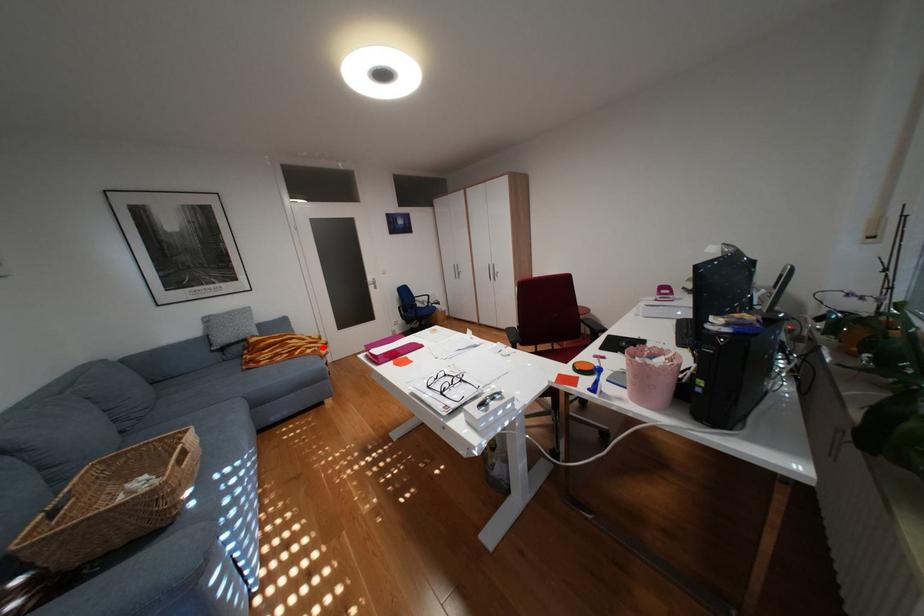
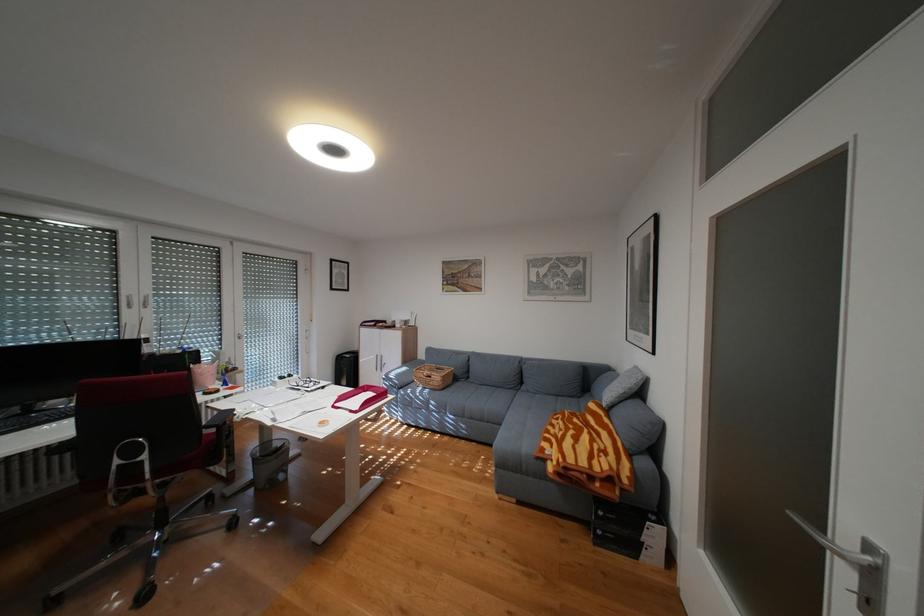
Question: I am providing you with two images of the same scene from different viewpoints. A red point is shown in image1. For the corresponding object point in image2, is it positioned nearer or farther from the camera?

Choices:
 (A) Nearer
 (B) Farther

Answer: (B)